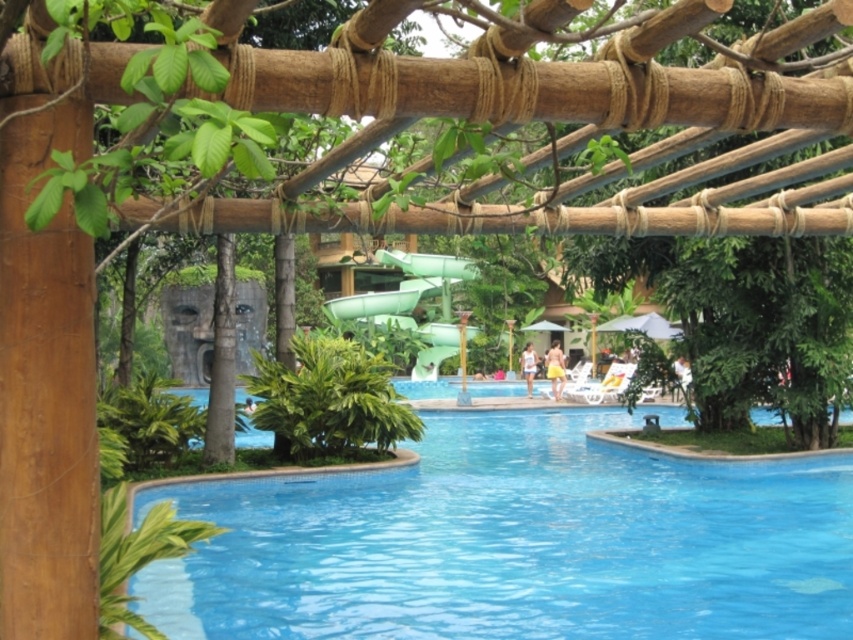
Which is more to the left, blue glossy pool at center or green rubber slide at center?

Positioned to the left is green rubber slide at center.

Looking at this image, which of these two, blue glossy pool at center or green rubber slide at center, stands shorter?

With less height is blue glossy pool at center.

What do you see at coordinates (515, 541) in the screenshot? This screenshot has height=640, width=853. I see `blue glossy pool at center` at bounding box center [515, 541].

This screenshot has width=853, height=640. In order to click on blue glossy pool at center in this screenshot , I will do `click(515, 541)`.